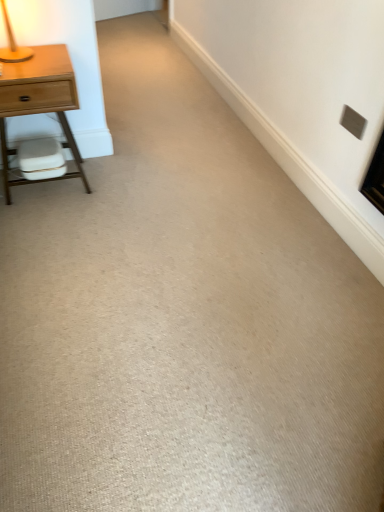
Where is `vacant space in front of light wood/finish nightstand at left`? vacant space in front of light wood/finish nightstand at left is located at coordinates (57, 226).